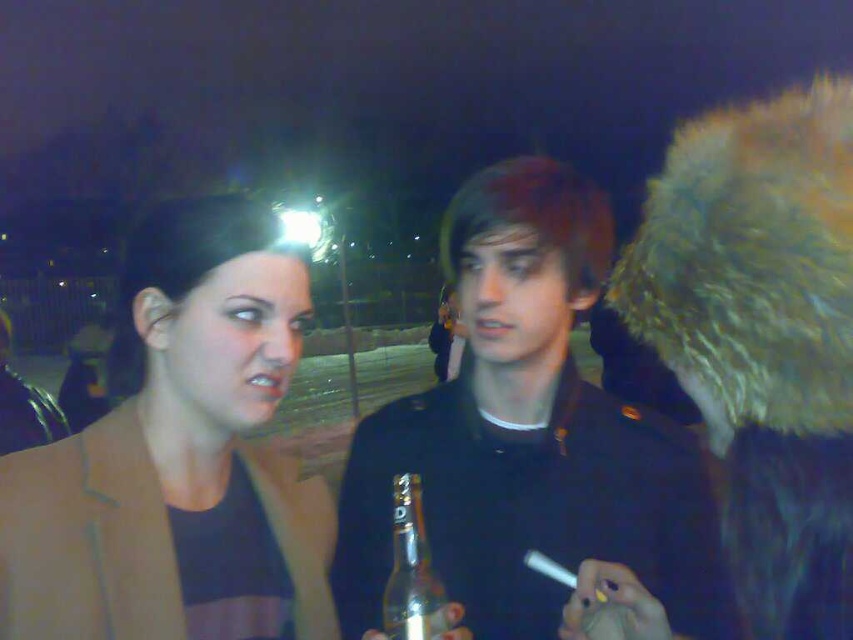
Is brown leather jacket at left above clear glass bottle at center?

Yes, brown leather jacket at left is above clear glass bottle at center.

Does brown leather jacket at left appear under clear glass bottle at center?

No.

Describe the element at coordinates (178, 458) in the screenshot. I see `brown leather jacket at left` at that location.

Where is `brown leather jacket at left`? brown leather jacket at left is located at coordinates (178, 458).

Is point (540, 547) farther from viewer compared to point (163, 452)?

That is True.

The width and height of the screenshot is (853, 640). Find the location of `shiny black jacket at center`. shiny black jacket at center is located at coordinates (529, 436).

Does shiny black jacket at center have a larger size compared to clear glass bottle at center?

Yes.

Is point (579, 262) in front of point (395, 627)?

No, (579, 262) is behind (395, 627).

I want to click on shiny black jacket at center, so click(x=529, y=436).